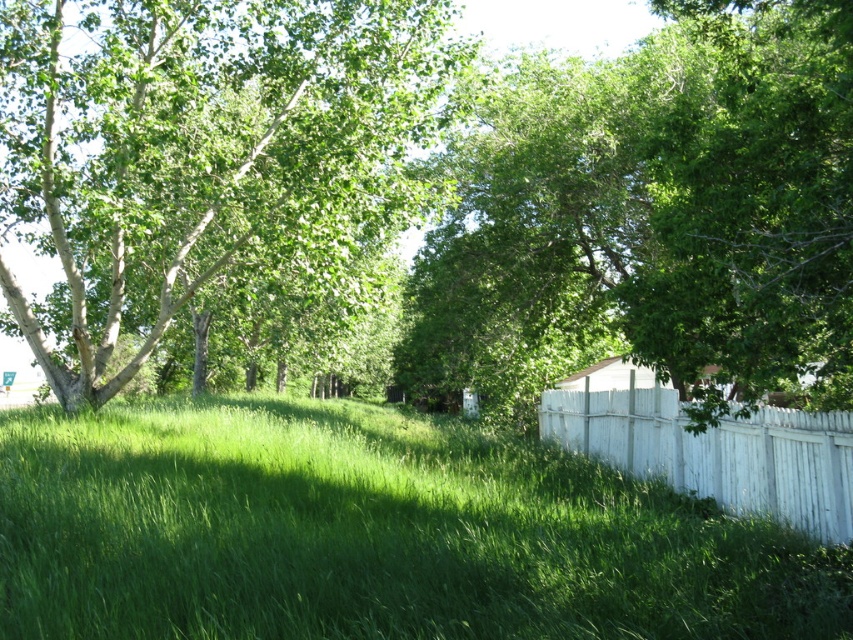
You are planning to take a photo of the green leafy tree at left and the white wooden fence at right. Which object should you focus on first if you want to capture both in a single frame without moving the camera?

The green leafy tree at left has a larger size compared to the white wooden fence at right, so you should focus on the green leafy tree at left first to ensure it fills the frame appropriately while still including the white wooden fence at right.

You are standing at the center of the image and want to walk towards the point labeled as point (x=799, y=449). Which direction should you face to ensure that the point labeled as point (x=161, y=160) is to your left side?

To have point (x=161, y=160) to your left while facing point (x=799, y=449), you should face northeast. This is because point (x=161, y=160) is behind point (x=799, y=449), so when facing northeast towards point (x=799, y=449), the other point will be to your left.